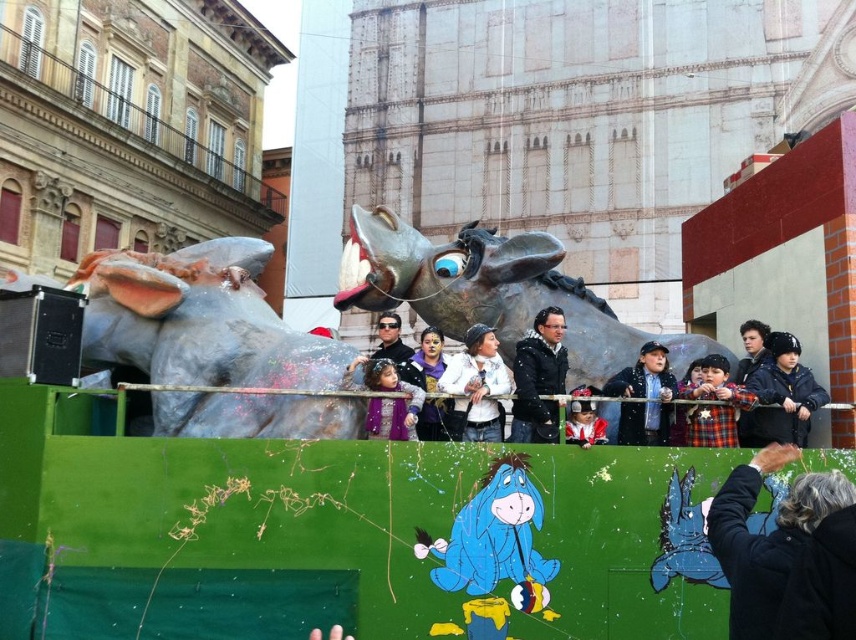
Which is in front, point (474, 248) or point (605, 426)?

Point (605, 426)

Which is behind, point (397, 264) or point (569, 432)?

Point (397, 264)

Is point (602, 380) positioned behind point (603, 428)?

Yes, point (602, 380) is farther from viewer.

At what (x,y) coordinates should I click in order to perform the action: click on bronze statue at center. Please return your answer as a coordinate pair (x, y). Image resolution: width=856 pixels, height=640 pixels. Looking at the image, I should click on (494, 292).

Image resolution: width=856 pixels, height=640 pixels. What do you see at coordinates (767, 536) in the screenshot?
I see `dark gray sweater at center` at bounding box center [767, 536].

This screenshot has width=856, height=640. Describe the element at coordinates (767, 536) in the screenshot. I see `dark gray sweater at center` at that location.

Locate an element on the screen. dark gray sweater at center is located at coordinates (767, 536).

Can you confirm if matte blue hat at center is positioned above smooth black hair at upper right?

Actually, matte blue hat at center is below smooth black hair at upper right.

Which is more to the left, matte blue hat at center or smooth black hair at upper right?

matte blue hat at center is more to the left.

Is point (587, 401) farther from camera compared to point (752, 317)?

No, it is not.

You are a GUI agent. You are given a task and a screenshot of the screen. Output one action in this format:
    pyautogui.click(x=<x>, y=<y>)
    Task: Click on the matte blue hat at center
    The height and width of the screenshot is (640, 856).
    Given the screenshot: What is the action you would take?
    pyautogui.click(x=584, y=419)